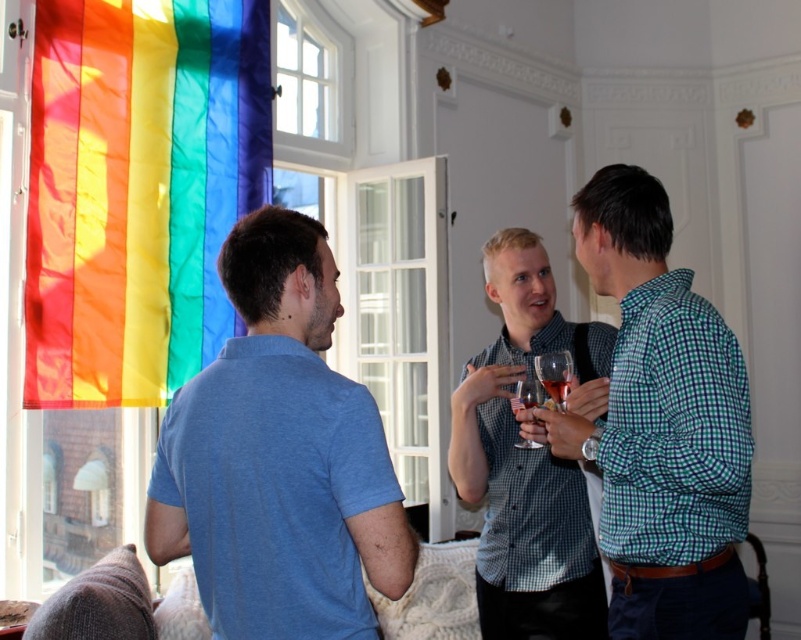
Question: Can you confirm if green checkered shirt at center is smaller than checkered fabric shirt at center?

Choices:
 (A) yes
 (B) no

Answer: (A)

Question: Which point is farther from the camera taking this photo?

Choices:
 (A) (497, 337)
 (B) (537, 362)
 (C) (272, 419)
 (D) (647, 241)

Answer: (A)

Question: Is the position of green checkered shirt at center less distant than that of checkered fabric shirt at center?

Choices:
 (A) yes
 (B) no

Answer: (A)

Question: Does rainbow fabric flag at left appear on the left side of green checkered shirt at center?

Choices:
 (A) no
 (B) yes

Answer: (B)

Question: Which point is closer to the camera?

Choices:
 (A) (516, 266)
 (B) (545, 362)
 (C) (242, 509)

Answer: (C)

Question: Among these points, which one is nearest to the camera?

Choices:
 (A) (530, 445)
 (B) (538, 372)
 (C) (143, 54)

Answer: (B)